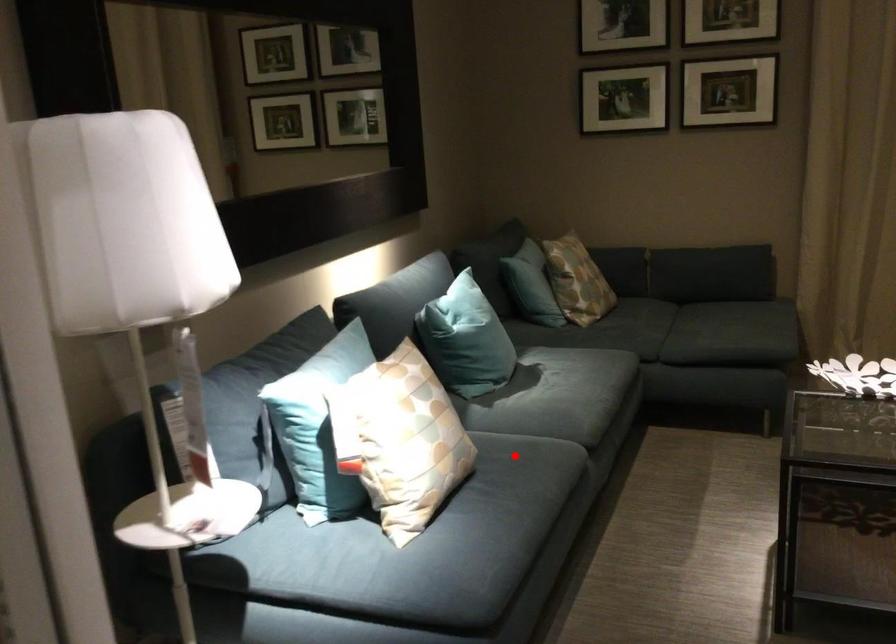
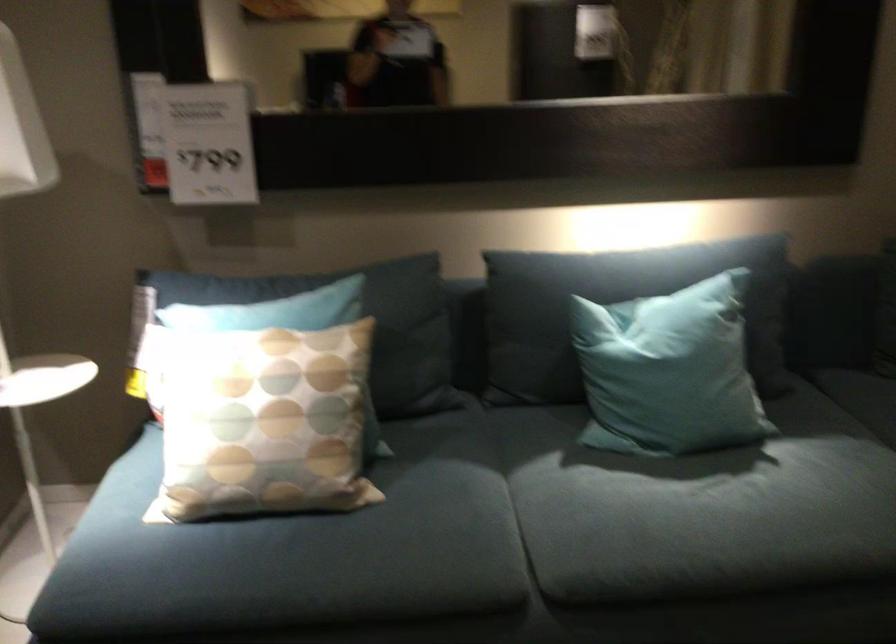
Locate, in the second image, the point that corresponds to the highlighted location in the first image.

(406, 526)